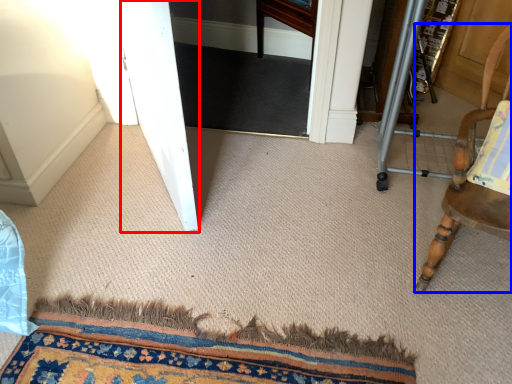
Question: Which object appears farthest to the camera in this image, screen door (highlighted by a red box) or chair (highlighted by a blue box)?

Choices:
 (A) screen door
 (B) chair

Answer: (A)